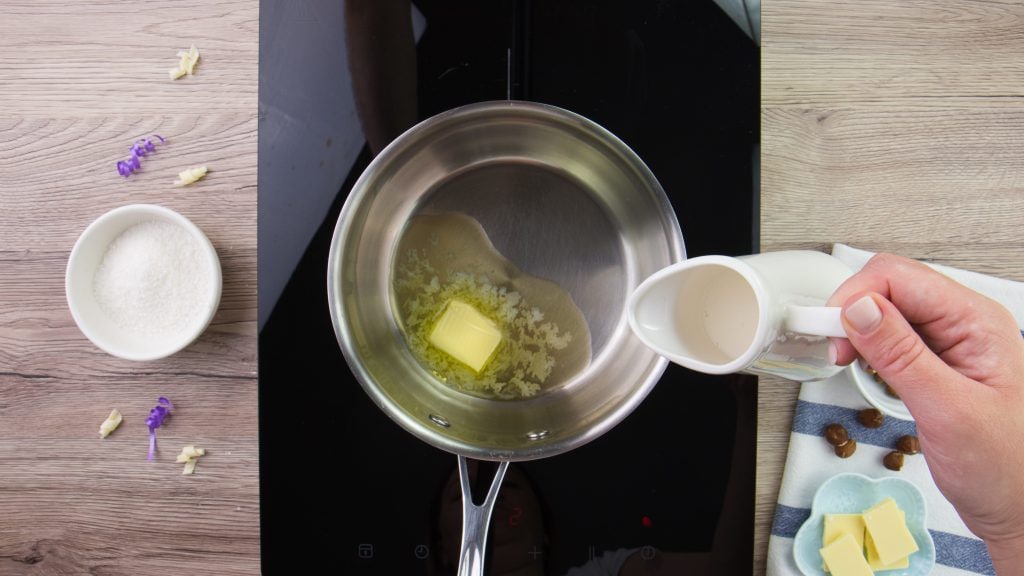
Identify the location of handle. This screenshot has height=576, width=1024. (470, 522).